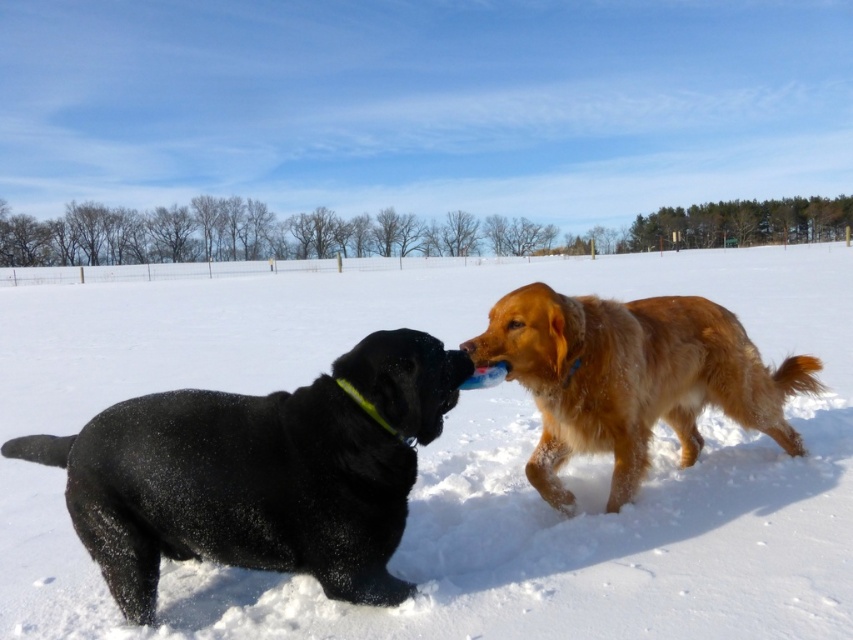
Measure the distance from white fluffy snow at center to black matte dog at left.

white fluffy snow at center and black matte dog at left are 7.48 meters apart.

Is white fluffy snow at center bigger than black matte dog at left?

Correct, white fluffy snow at center is larger in size than black matte dog at left.

The height and width of the screenshot is (640, 853). What are the coordinates of `white fluffy snow at center` in the screenshot? It's located at (456, 460).

Where is `white fluffy snow at center`? The width and height of the screenshot is (853, 640). white fluffy snow at center is located at coordinates (456, 460).

Describe the element at coordinates (260, 474) in the screenshot. I see `black matte dog at left` at that location.

Does black matte dog at left have a smaller size compared to golden fur dog at center?

Yes, black matte dog at left is smaller than golden fur dog at center.

Does point (238, 525) lie behind point (666, 324)?

No.

Where is `black matte dog at left`? black matte dog at left is located at coordinates (260, 474).

Which of these two, white fluffy snow at center or golden fur dog at center, stands taller?

white fluffy snow at center

Is white fluffy snow at center to the right of golden fur dog at center from the viewer's perspective?

No, white fluffy snow at center is not to the right of golden fur dog at center.

Where is `white fluffy snow at center`? This screenshot has height=640, width=853. white fluffy snow at center is located at coordinates (456, 460).